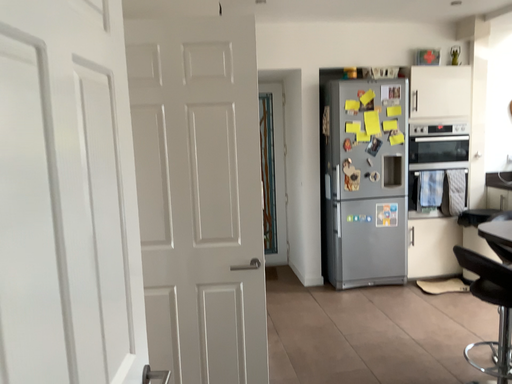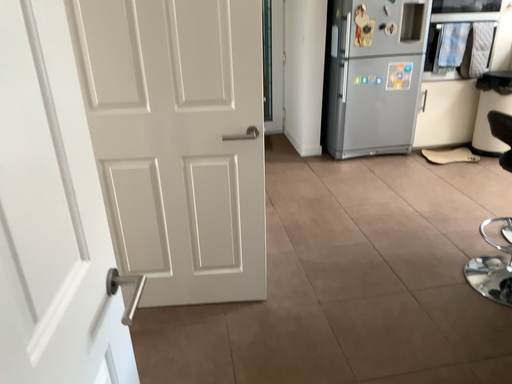
Question: How did the camera likely rotate when shooting the video?

Choices:
 (A) rotated downward
 (B) rotated upward

Answer: (A)